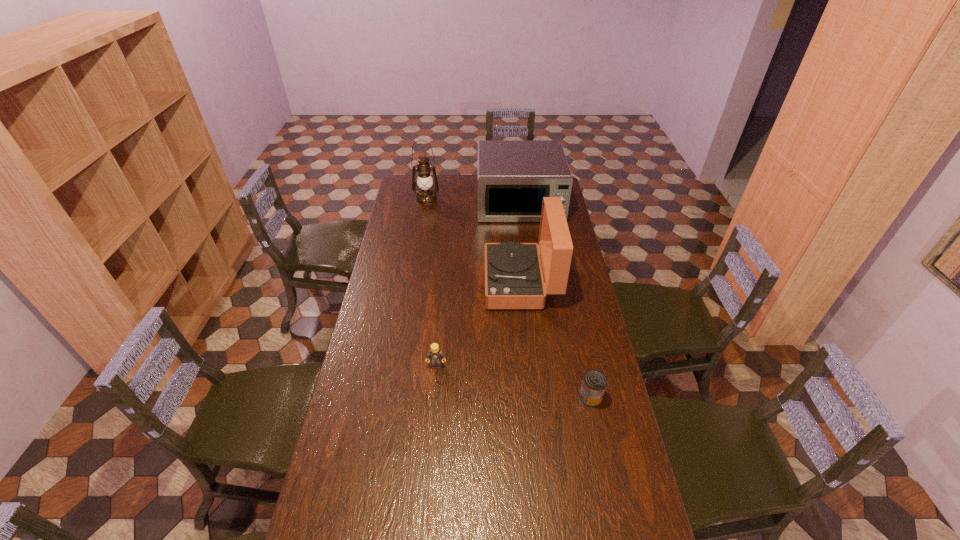
You are a GUI agent. You are given a task and a screenshot of the screen. Output one action in this format:
    pyautogui.click(x=<x>, y=<y>)
    Task: Click on the free spot that satisfies the following two spatial constraints: 1. with the door open on the microwave oven; 2. on the face of the third nearest object
    
    Given the screenshot: What is the action you would take?
    pyautogui.click(x=529, y=282)

Where is `vacant region that satisfies the following two spatial constraints: 1. in front of the second nearest object; 2. on the left side of the nearest object`? vacant region that satisfies the following two spatial constraints: 1. in front of the second nearest object; 2. on the left side of the nearest object is located at coordinates (434, 397).

The width and height of the screenshot is (960, 540). I want to click on vacant space that satisfies the following two spatial constraints: 1. with the door open on the microwave oven; 2. on the left side of the nearest object, so click(543, 397).